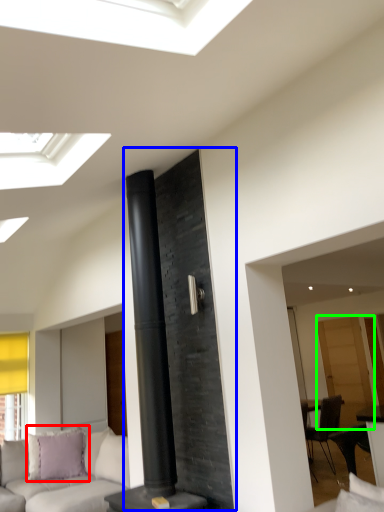
Question: Estimate the real-world distances between objects in this image. Which object is closer to pillow (highlighted by a red box), fireplace (highlighted by a blue box) or glass door (highlighted by a green box)?

Choices:
 (A) fireplace
 (B) glass door

Answer: (A)